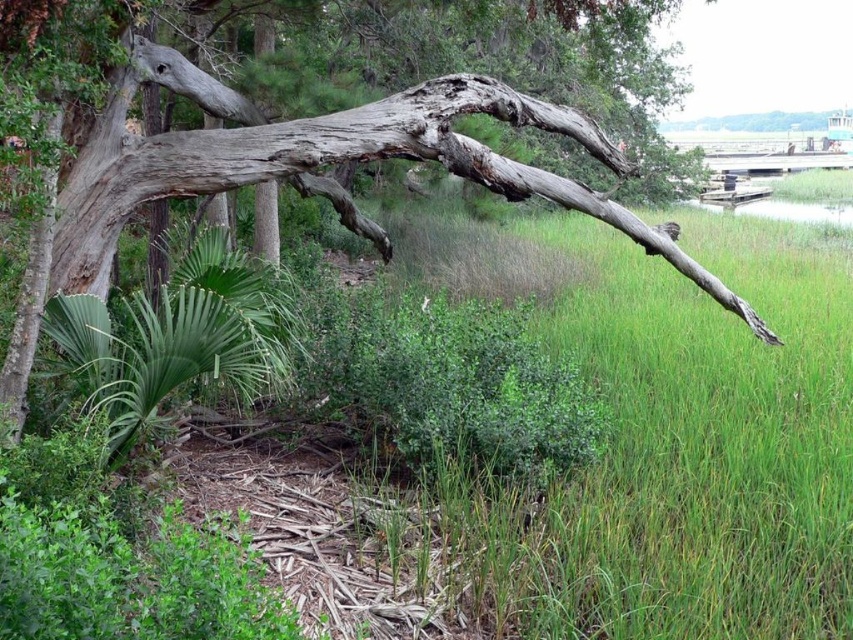
Question: Can you confirm if gray rough bark tree at upper left is thinner than green leafy plant at lower left?

Choices:
 (A) yes
 (B) no

Answer: (B)

Question: Which point is closer to the camera taking this photo?

Choices:
 (A) (173, 83)
 (B) (193, 320)

Answer: (B)

Question: Which object is closer to the camera taking this photo?

Choices:
 (A) green leafy plant at lower left
 (B) gray rough bark tree at upper left

Answer: (A)

Question: Does gray rough bark tree at upper left appear under green leafy plant at lower left?

Choices:
 (A) no
 (B) yes

Answer: (A)

Question: Is gray rough bark tree at upper left positioned at the back of green leafy plant at lower left?

Choices:
 (A) yes
 (B) no

Answer: (A)